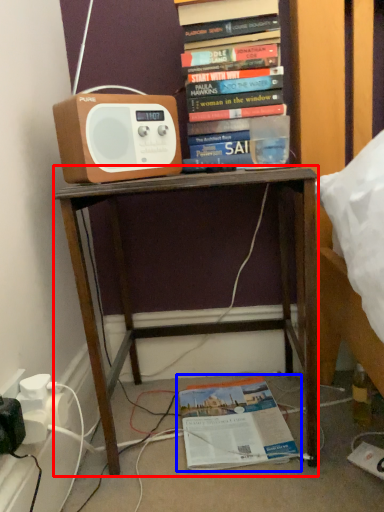
Question: Which of the following is the farthest to the observer, desk (highlighted by a red box) or book (highlighted by a blue box)?

Choices:
 (A) desk
 (B) book

Answer: (B)